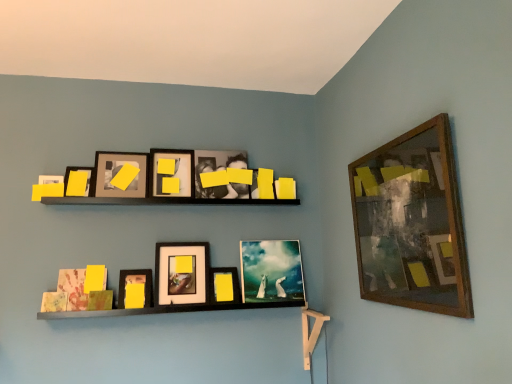
Question: In which direction should I rotate to look at matte yellow paper at lower center, positioned as the 3th picture frame in left-to-right order?

Choices:
 (A) left
 (B) right

Answer: (A)

Question: Is the position of matte black picture frame at upper left, which is the 9th picture frame in right-to-left order, less distant than that of wooden-framed artwork at upper right, which appears as the 1th picture frame when viewed from the right?

Choices:
 (A) yes
 (B) no

Answer: (B)

Question: Is matte black picture frame at upper left, positioned as the 1th picture frame in left-to-right order, shorter than wooden-framed artwork at upper right, placed as the ninth picture frame when sorted from left to right?

Choices:
 (A) yes
 (B) no

Answer: (A)

Question: Is matte black picture frame at upper left, which is the 9th picture frame in right-to-left order, to the right of wooden-framed artwork at upper right, placed as the ninth picture frame when sorted from left to right, from the viewer's perspective?

Choices:
 (A) yes
 (B) no

Answer: (B)

Question: Is matte black picture frame at upper left, which is the 9th picture frame in right-to-left order, positioned beyond the bounds of wooden-framed artwork at upper right, placed as the ninth picture frame when sorted from left to right?

Choices:
 (A) yes
 (B) no

Answer: (A)

Question: Is matte black picture frame at upper left, positioned as the 1th picture frame in left-to-right order, aimed at wooden-framed artwork at upper right, which appears as the 1th picture frame when viewed from the right?

Choices:
 (A) no
 (B) yes

Answer: (A)

Question: Considering the relative sizes of matte black picture frame at upper left, which is the 9th picture frame in right-to-left order, and wooden-framed artwork at upper right, placed as the ninth picture frame when sorted from left to right, in the image provided, is matte black picture frame at upper left, which is the 9th picture frame in right-to-left order, taller than wooden-framed artwork at upper right, placed as the ninth picture frame when sorted from left to right,?

Choices:
 (A) yes
 (B) no

Answer: (B)

Question: From a real-world perspective, is wooden shelf at center located higher than yellow matte picture frame at center, which appears as the third picture frame when viewed from the right?

Choices:
 (A) yes
 (B) no

Answer: (A)

Question: Is wooden shelf at center next to yellow matte picture frame at center, which appears as the third picture frame when viewed from the right, and touching it?

Choices:
 (A) yes
 (B) no

Answer: (B)

Question: Is wooden shelf at center taller than yellow matte picture frame at center, which is counted as the seventh picture frame, starting from the left?

Choices:
 (A) yes
 (B) no

Answer: (A)

Question: Is wooden shelf at center in front of yellow matte picture frame at center, which appears as the third picture frame when viewed from the right?

Choices:
 (A) yes
 (B) no

Answer: (A)

Question: Considering the relative sizes of wooden shelf at center and yellow matte picture frame at center, which is counted as the seventh picture frame, starting from the left, in the image provided, is wooden shelf at center smaller than yellow matte picture frame at center, which is counted as the seventh picture frame, starting from the left,?

Choices:
 (A) yes
 (B) no

Answer: (B)

Question: Can we say wooden shelf at center lies outside yellow matte picture frame at center, which appears as the third picture frame when viewed from the right?

Choices:
 (A) no
 (B) yes

Answer: (B)

Question: Is yellow matte picture frame at center, which appears as the third picture frame when viewed from the right, positioned before matte black picture frame at upper left, which is the 9th picture frame in right-to-left order?

Choices:
 (A) yes
 (B) no

Answer: (B)